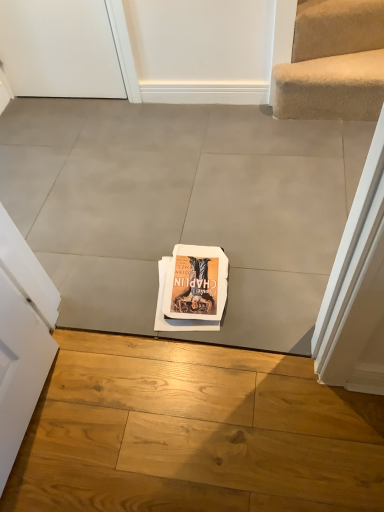
In the scene shown: In order to face gray tile floor at center, which is the first concrete in front-to-back order, should I rotate leftwards or rightwards?

You should look left and rotate roughly 0.155 degrees.

The width and height of the screenshot is (384, 512). Describe the element at coordinates (194, 432) in the screenshot. I see `gray tile floor at center, the second concrete in the top-to-bottom sequence` at that location.

Find the location of a particular element. The width and height of the screenshot is (384, 512). matte paper book at center is located at coordinates (192, 289).

What do you see at coordinates (180, 207) in the screenshot?
I see `gray concrete at center, the 2th concrete positioned from the front` at bounding box center [180, 207].

At what (x,y) coordinates should I click in order to perform the action: click on gray tile floor at center, marked as the 1th concrete in a bottom-to-top arrangement. Please return your answer as a coordinate pair (x, y). The height and width of the screenshot is (512, 384). Looking at the image, I should click on (194, 432).

Is gray concrete at center, which ranks as the 1th concrete in back-to-front order, looking in the opposite direction of white matte door at upper left?

gray concrete at center, which ranks as the 1th concrete in back-to-front order, does not have its back to white matte door at upper left.

From the image's perspective, which is above, gray concrete at center, arranged as the first concrete when viewed from the top, or white matte door at upper left?

From the image's view, white matte door at upper left is above.

Can you confirm if gray concrete at center, arranged as the first concrete when viewed from the top, is bigger than white matte door at upper left?

Indeed, gray concrete at center, arranged as the first concrete when viewed from the top, has a larger size compared to white matte door at upper left.

Is gray concrete at center, the 2th concrete positioned from the front, taller than white matte door at upper left?

Incorrect, the height of gray concrete at center, the 2th concrete positioned from the front, is not larger of that of white matte door at upper left.

Which is closer, (93, 210) or (168, 311)?

Clearly, point (93, 210) is more distant from the camera than point (168, 311).

How many degrees apart are the facing directions of gray concrete at center, the second concrete when ordered from bottom to top, and matte paper book at center?

They differ by 173 degrees in their facing directions.

From a real-world perspective, count 2nd concretes upward from the matte paper book at center and point to it. Please provide its 2D coordinates.

[(180, 207)]

Where is `concrete above the gray tile floor at center, which is the first concrete in front-to-back order (from the image's perspective)`? This screenshot has height=512, width=384. concrete above the gray tile floor at center, which is the first concrete in front-to-back order (from the image's perspective) is located at coordinates point(180,207).

Is gray tile floor at center, the second concrete in the top-to-bottom sequence, facing towards gray concrete at center, which ranks as the 1th concrete in back-to-front order?

Yes, gray tile floor at center, the second concrete in the top-to-bottom sequence, is turned towards gray concrete at center, which ranks as the 1th concrete in back-to-front order.

Based on the photo, does gray tile floor at center, which is the first concrete in front-to-back order, have a larger size compared to gray concrete at center, the 2th concrete positioned from the front?

Actually, gray tile floor at center, which is the first concrete in front-to-back order, might be smaller than gray concrete at center, the 2th concrete positioned from the front.

Looking at this image, is the position of gray concrete at center, the second concrete when ordered from bottom to top, more distant than that of gray tile floor at center, the second concrete in the top-to-bottom sequence?

Yes.

Find the location of a particular element. Image resolution: width=384 pixels, height=512 pixels. concrete behind the gray tile floor at center, the second concrete in the top-to-bottom sequence is located at coordinates (180, 207).

Which object is positioned more to the left, gray concrete at center, the 2th concrete positioned from the front, or gray tile floor at center, the 2th concrete from the back?

From the viewer's perspective, gray concrete at center, the 2th concrete positioned from the front, appears more on the left side.

Is white matte door at upper left bigger or smaller than gray concrete at center, the second concrete when ordered from bottom to top?

Considering their sizes, white matte door at upper left takes up less space than gray concrete at center, the second concrete when ordered from bottom to top.

From the image's perspective, is white matte door at upper left on top of gray concrete at center, the 2th concrete positioned from the front?

Yes.

Which of these two, white matte door at upper left or gray concrete at center, arranged as the first concrete when viewed from the top, is thinner?

Thinner between the two is white matte door at upper left.

Would you consider white matte door at upper left to be distant from gray concrete at center, the 2th concrete positioned from the front?

No.

From a real-world perspective, is matte paper book at center under white matte door at upper left?

Yes, from a real-world perspective, matte paper book at center is under white matte door at upper left.

Is matte paper book at center outside of white matte door at upper left?

That's correct, matte paper book at center is outside of white matte door at upper left.

Considering the sizes of objects matte paper book at center and white matte door at upper left in the image provided, who is wider, matte paper book at center or white matte door at upper left?

With larger width is matte paper book at center.

From the image's perspective, which one is positioned higher, matte paper book at center or white matte door at upper left?

white matte door at upper left.

Find the location of a particular element. The height and width of the screenshot is (512, 384). concrete that is the 2nd one when counting downward from the white matte door at upper left (from the image's perspective) is located at coordinates (194, 432).

Which object is wider, gray tile floor at center, the 2th concrete from the back, or white matte door at upper left?

With larger width is gray tile floor at center, the 2th concrete from the back.

From the image's perspective, is gray tile floor at center, the second concrete in the top-to-bottom sequence, above white matte door at upper left?

No.

This screenshot has height=512, width=384. In order to click on door above the gray concrete at center, arranged as the first concrete when viewed from the top (from the image's perspective) in this screenshot , I will do (59, 49).

Locate an element on the screen. This screenshot has width=384, height=512. concrete on the left of the matte paper book at center is located at coordinates (180, 207).

When comparing their distances from white matte door at upper left, does gray concrete at center, arranged as the first concrete when viewed from the top, or gray tile floor at center, which is the first concrete in front-to-back order, seem further?

gray tile floor at center, which is the first concrete in front-to-back order, is further to white matte door at upper left.

From the image, which object appears to be nearer to gray concrete at center, arranged as the first concrete when viewed from the top, matte paper book at center or gray tile floor at center, the second concrete in the top-to-bottom sequence?

matte paper book at center is closer to gray concrete at center, arranged as the first concrete when viewed from the top.

Estimate the real-world distances between objects in this image. Which object is closer to gray concrete at center, the second concrete when ordered from bottom to top, gray tile floor at center, marked as the 1th concrete in a bottom-to-top arrangement, or matte paper book at center?

The object closer to gray concrete at center, the second concrete when ordered from bottom to top, is matte paper book at center.

Which object lies further to the anchor point white matte door at upper left, gray tile floor at center, marked as the 1th concrete in a bottom-to-top arrangement, or matte paper book at center?

gray tile floor at center, marked as the 1th concrete in a bottom-to-top arrangement, is further to white matte door at upper left.

Estimate the real-world distances between objects in this image. Which object is further from gray tile floor at center, the 2th concrete from the back, gray concrete at center, arranged as the first concrete when viewed from the top, or white matte door at upper left?

white matte door at upper left.

Estimate the real-world distances between objects in this image. Which object is further from gray tile floor at center, marked as the 1th concrete in a bottom-to-top arrangement, matte paper book at center or white matte door at upper left?

white matte door at upper left lies further to gray tile floor at center, marked as the 1th concrete in a bottom-to-top arrangement, than the other object.

Considering their positions, is white matte door at upper left positioned closer to matte paper book at center than gray concrete at center, arranged as the first concrete when viewed from the top?

Based on the image, gray concrete at center, arranged as the first concrete when viewed from the top, appears to be nearer to matte paper book at center.

Estimate the real-world distances between objects in this image. Which object is closer to white matte door at upper left, matte paper book at center or gray tile floor at center, marked as the 1th concrete in a bottom-to-top arrangement?

Among the two, matte paper book at center is located nearer to white matte door at upper left.

Find the location of a particular element. The width and height of the screenshot is (384, 512). paperback book between white matte door at upper left and gray tile floor at center, marked as the 1th concrete in a bottom-to-top arrangement, in the up-down direction is located at coordinates (192, 289).

I want to click on concrete between white matte door at upper left and gray tile floor at center, the 2th concrete from the back, in the vertical direction, so click(180, 207).

I want to click on concrete between white matte door at upper left and matte paper book at center in the vertical direction, so click(180, 207).

Find the location of `paperback book between gray concrete at center, the second concrete when ordered from bottom to top, and gray tile floor at center, the second concrete in the top-to-bottom sequence, vertically`. paperback book between gray concrete at center, the second concrete when ordered from bottom to top, and gray tile floor at center, the second concrete in the top-to-bottom sequence, vertically is located at coordinates (192, 289).